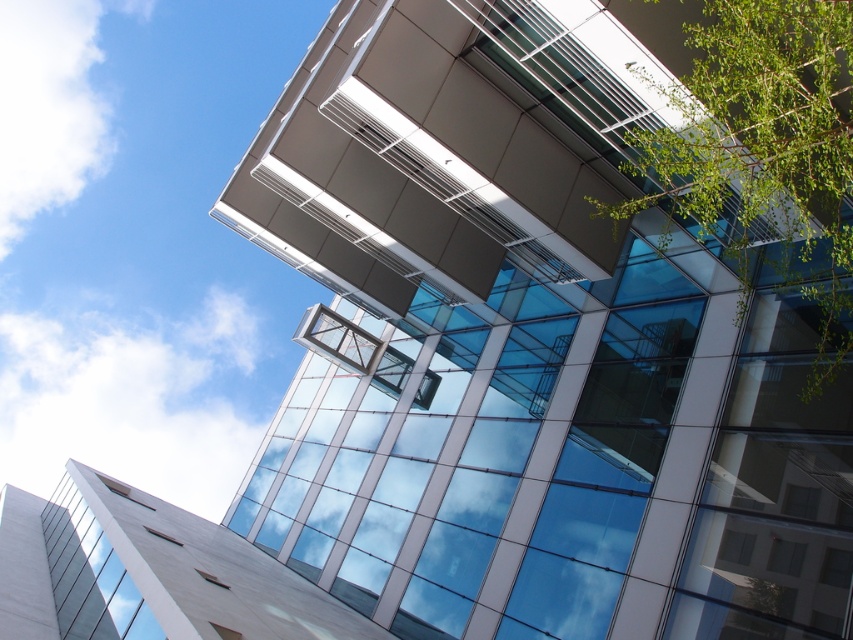
Question: Does green leafy tree at upper right have a greater width compared to transparent glass window at lower left?

Choices:
 (A) yes
 (B) no

Answer: (B)

Question: Which of the following is the closest to the observer?

Choices:
 (A) green leafy tree at upper right
 (B) transparent glass window at lower left

Answer: (A)

Question: Is green leafy tree at upper right to the right of transparent glass window at lower left from the viewer's perspective?

Choices:
 (A) yes
 (B) no

Answer: (A)

Question: Does green leafy tree at upper right appear on the left side of transparent glass window at lower left?

Choices:
 (A) no
 (B) yes

Answer: (A)